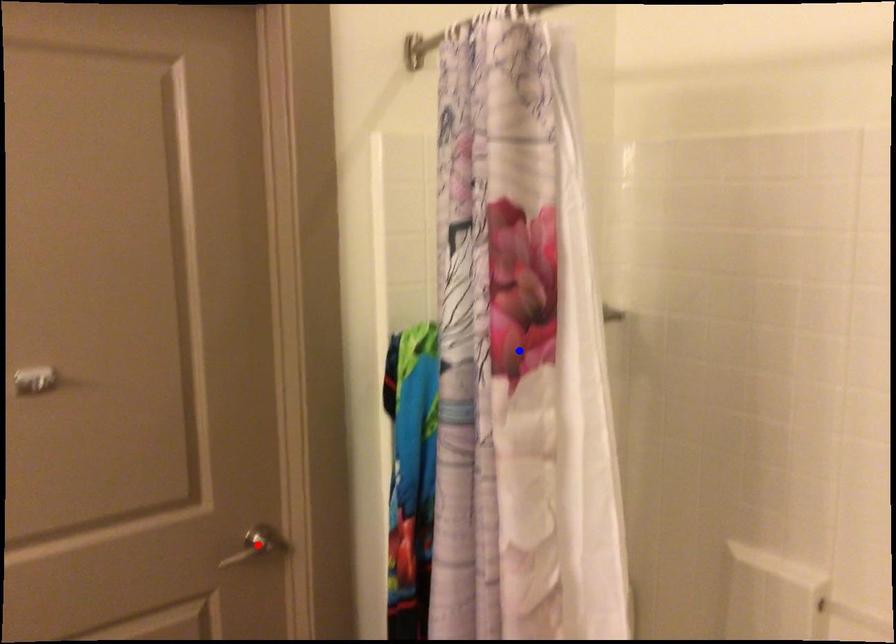
Question: Which of the two points in the image is closer to the camera?

Choices:
 (A) Blue point is closer.
 (B) Red point is closer.

Answer: (A)